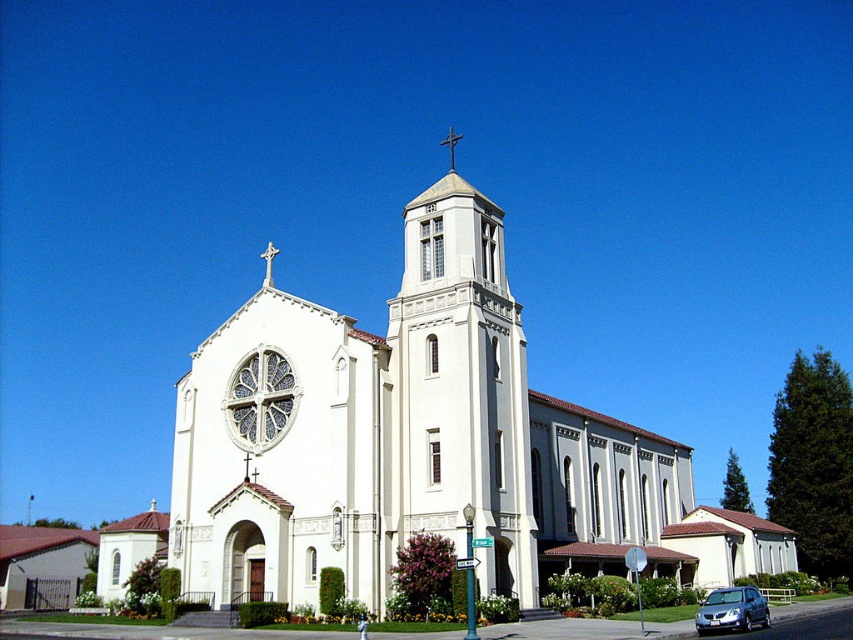
Does satin silver sedan at lower right appear over white stone cross at upper center?

Actually, satin silver sedan at lower right is below white stone cross at upper center.

Image resolution: width=853 pixels, height=640 pixels. I want to click on satin silver sedan at lower right, so pyautogui.click(x=730, y=611).

What do you see at coordinates (730, 611) in the screenshot? This screenshot has height=640, width=853. I see `satin silver sedan at lower right` at bounding box center [730, 611].

Where is `satin silver sedan at lower right`? satin silver sedan at lower right is located at coordinates (730, 611).

Can you confirm if white smooth steeple at center is shorter than satin silver sedan at lower right?

In fact, white smooth steeple at center may be taller than satin silver sedan at lower right.

Can you confirm if white smooth steeple at center is wider than satin silver sedan at lower right?

In fact, white smooth steeple at center might be narrower than satin silver sedan at lower right.

This screenshot has height=640, width=853. I want to click on white smooth steeple at center, so click(x=461, y=388).

In order to click on white smooth steeple at center in this screenshot , I will do `click(461, 388)`.

Consider the image. Can you confirm if white stone cross at upper center is taller than metallic cross at upper center?

Indeed, white stone cross at upper center has a greater height compared to metallic cross at upper center.

Locate an element on the screen. The image size is (853, 640). white stone cross at upper center is located at coordinates (268, 262).